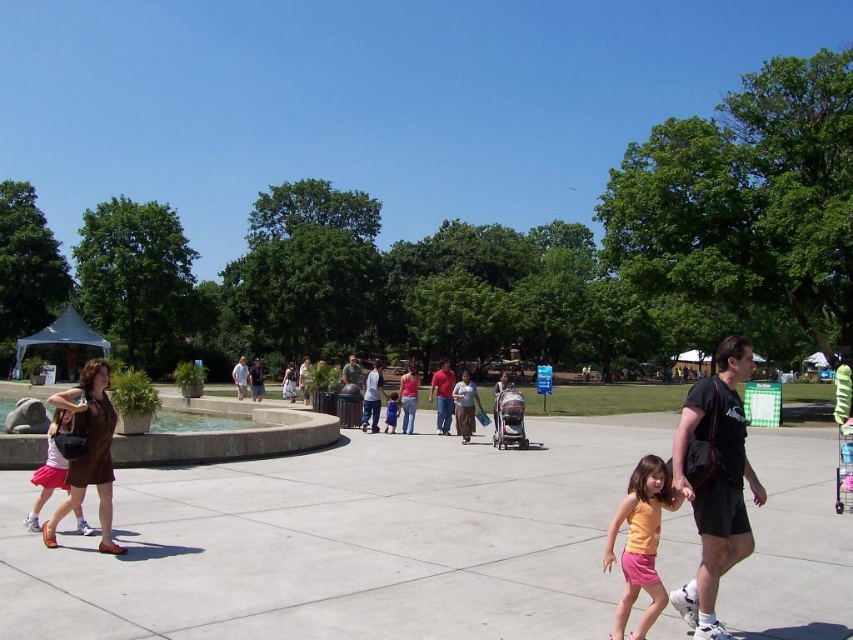
Which of these two, smooth concrete fountain at center left or orange matte tank top at lower center, stands taller?

Standing taller between the two is orange matte tank top at lower center.

Can you confirm if smooth concrete fountain at center left is positioned below orange matte tank top at lower center?

Indeed, smooth concrete fountain at center left is positioned under orange matte tank top at lower center.

Is point (206, 442) positioned before point (606, 540)?

No, (206, 442) is further to viewer.

I want to click on smooth concrete fountain at center left, so click(227, 435).

Can you confirm if black fabric shirt at center-right is positioned to the right of blue denim shorts at center?

Correct, you'll find black fabric shirt at center-right to the right of blue denim shorts at center.

The height and width of the screenshot is (640, 853). What do you see at coordinates (714, 481) in the screenshot?
I see `black fabric shirt at center-right` at bounding box center [714, 481].

Measure the distance between point (712,636) and camera.

Point (712,636) is 4.30 meters from camera.

In order to click on black fabric shirt at center-right in this screenshot , I will do `click(714, 481)`.

Can you confirm if orange matte tank top at lower center is taller than blue denim shorts at center?

Yes.

Locate an element on the screen. orange matte tank top at lower center is located at coordinates (640, 541).